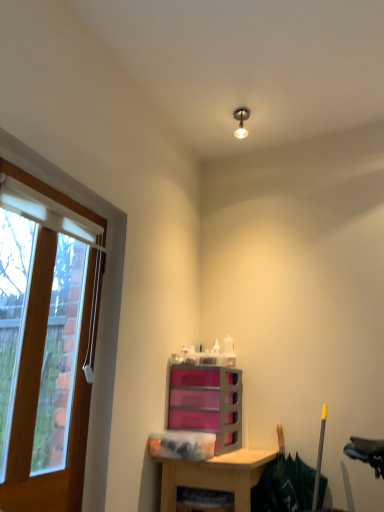
Question: Choose the correct answer: Is wooden frame at left inside metallic bulb at upper center or outside it?

Choices:
 (A) outside
 (B) inside

Answer: (A)

Question: In the image, is wooden frame at left positioned in front of or behind metallic bulb at upper center?

Choices:
 (A) behind
 (B) front

Answer: (B)

Question: Based on their relative distances, which object is nearer to the wooden desk at lower center?

Choices:
 (A) metallic bulb at upper center
 (B) pink plastic drawers at center
 (C) wooden frame at left

Answer: (B)

Question: Estimate the real-world distances between objects in this image. Which object is farther from the metallic bulb at upper center?

Choices:
 (A) wooden frame at left
 (B) wooden desk at lower center
 (C) pink plastic drawers at center

Answer: (B)